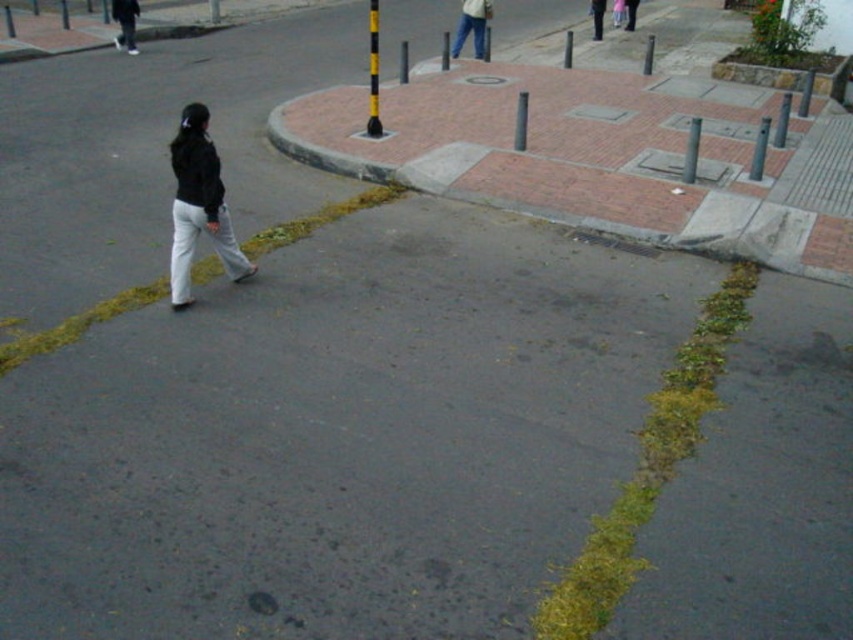
You are a pedestrian on the street and see the matte black jacket at left and jeans at center. Which one is positioned more to the left?

The matte black jacket at left is positioned to the left of jeans at center, so the matte black jacket at left is more to the left.

You are standing at the point with coordinates point [598,36] and want to walk to the point with coordinates point [172,246]. Which direction should you move relative to your current position?

You should move forward because point [172,246] is in front of point [598,36].

You are a photographer trying to capture the person in the scene. Since the matte black jacket at left and dark blue jeans at center are at different heights, which one should you focus on to ensure both are in frame without cropping?

The matte black jacket at left is much taller than the dark blue jeans at center, so focusing on the matte black jacket at left will ensure both are in frame without cropping.